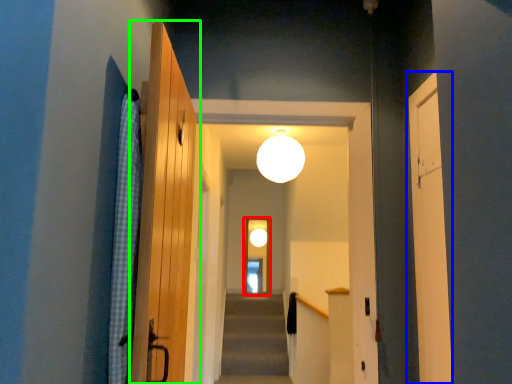
Question: Which is farther away from screen door (highlighted by a red box)? door (highlighted by a blue box) or door (highlighted by a green box)?

Choices:
 (A) door
 (B) door

Answer: (B)